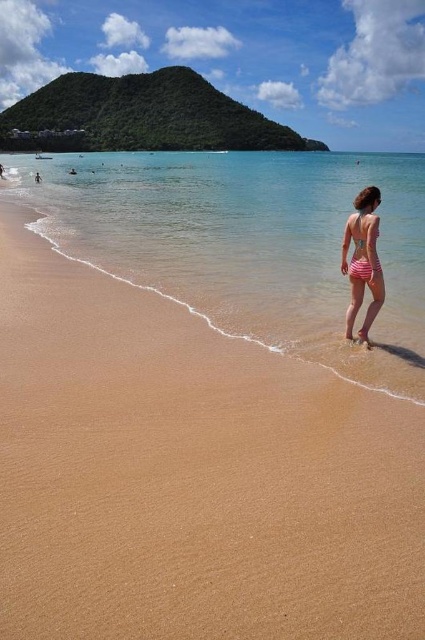
Can you confirm if sandy tan beach at center is positioned to the left of pink striped swimsuit at right?

Correct, you'll find sandy tan beach at center to the left of pink striped swimsuit at right.

Who is more distant from viewer, [308,472] or [370,264]?

Positioned behind is point [370,264].

Identify the location of sandy tan beach at center. The image size is (425, 640). (189, 474).

Is the position of clear blue water at center less distant than that of pink striped swimsuit at right?

Yes, it is.

Does point (197, 280) come farther from viewer compared to point (371, 234)?

Yes, point (197, 280) is farther from viewer.

Who is more distant from viewer, (x=107, y=157) or (x=374, y=205)?

Positioned behind is point (x=107, y=157).

The width and height of the screenshot is (425, 640). I want to click on clear blue water at center, so click(x=248, y=243).

Which is in front, point (186, 525) or point (130, 230)?

Point (186, 525) is in front.

Does sandy tan beach at center have a smaller size compared to clear blue water at center?

Indeed, sandy tan beach at center has a smaller size compared to clear blue water at center.

Identify the location of sandy tan beach at center. (189, 474).